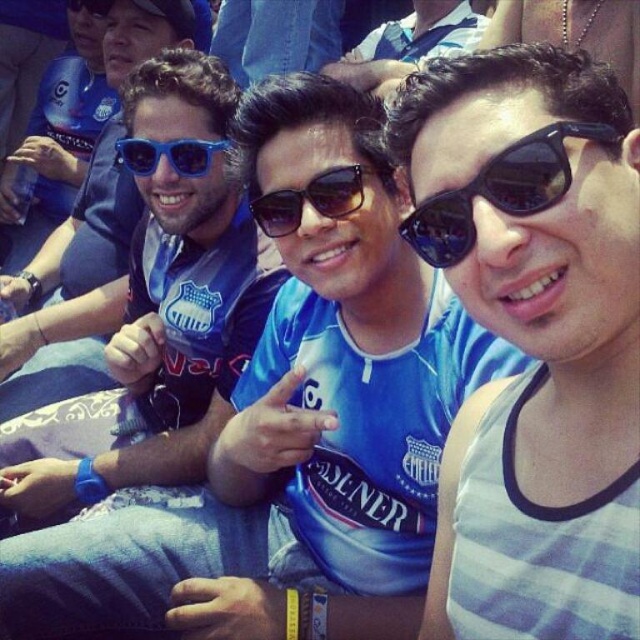
You are standing in the crowd at the soccer match and want to find the black reflective sunglasses at upper right. According to the scene description, where exactly are they positioned relative to the other objects?

The black reflective sunglasses at upper right are located at point 0.298 along the horizontal axis and 0.783 along the vertical axis within the image frame.

You are a photographer at the sports event. You need to adjust your camera to capture both the black reflective sunglasses at upper right and the sunglasses at center in focus. Which sunglasses should you focus on first to ensure they are both in the frame?

The black reflective sunglasses at upper right is much taller than the sunglasses at center, so you should focus on the black reflective sunglasses at upper right first to ensure both are in the frame.

You are a photographer standing in front of the three men. You want to take a photo that includes both the matte blue jersey at center and the sunglasses at center. Which object should you focus on first to ensure both are in clear focus?

The matte blue jersey at center is further to the viewer than the sunglasses at center, so you should focus on the matte blue jersey at center first to ensure both are in clear focus.